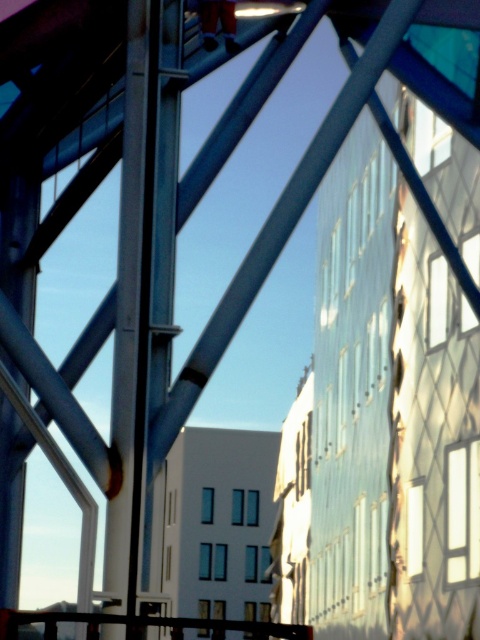
Between metallic pole at center and black metal rail at lower center, which one has less height?

With less height is metallic pole at center.

Which is behind, point (155, 72) or point (63, 620)?

Point (155, 72)

Who is more forward, (136, 51) or (250, 634)?

Point (250, 634)

I want to click on metallic pole at center, so click(132, 308).